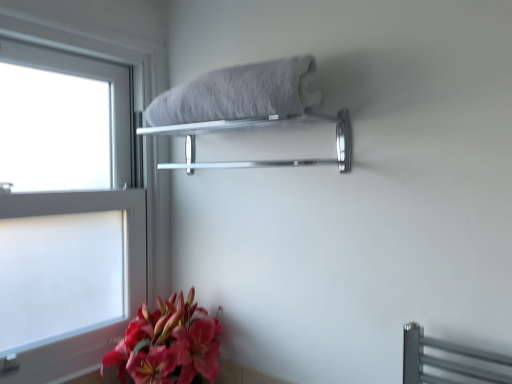
Question: Can you confirm if silver metallic towel rack at upper center is positioned to the right of matte pink lily at lower left?

Choices:
 (A) yes
 (B) no

Answer: (A)

Question: Would you say matte pink lily at lower left is part of silver metallic towel rack at upper center's contents?

Choices:
 (A) yes
 (B) no

Answer: (B)

Question: From a real-world perspective, is silver metallic towel rack at upper center positioned under matte pink lily at lower left based on gravity?

Choices:
 (A) yes
 (B) no

Answer: (B)

Question: Considering the relative sizes of silver metallic towel rack at upper center and matte pink lily at lower left in the image provided, is silver metallic towel rack at upper center thinner than matte pink lily at lower left?

Choices:
 (A) yes
 (B) no

Answer: (A)

Question: Considering the relative positions of silver metallic towel rack at upper center and matte pink lily at lower left in the image provided, is silver metallic towel rack at upper center in front of matte pink lily at lower left?

Choices:
 (A) no
 (B) yes

Answer: (B)

Question: Would you say gray fluffy bath towel at upper center is inside or outside matte pink lily at lower left?

Choices:
 (A) inside
 (B) outside

Answer: (B)

Question: From the image's perspective, is gray fluffy bath towel at upper center above or below matte pink lily at lower left?

Choices:
 (A) above
 (B) below

Answer: (A)

Question: Considering the positions of gray fluffy bath towel at upper center and matte pink lily at lower left in the image, is gray fluffy bath towel at upper center wider or thinner than matte pink lily at lower left?

Choices:
 (A) thin
 (B) wide

Answer: (A)

Question: In the image, is gray fluffy bath towel at upper center positioned in front of or behind matte pink lily at lower left?

Choices:
 (A) front
 (B) behind

Answer: (A)

Question: Looking at the image, does clear glass window at left seem bigger or smaller compared to silver metallic towel rack at upper center?

Choices:
 (A) big
 (B) small

Answer: (A)

Question: Relative to silver metallic towel rack at upper center, is clear glass window at left in front or behind?

Choices:
 (A) front
 (B) behind

Answer: (B)

Question: From a real-world perspective, is clear glass window at left physically located above or below silver metallic towel rack at upper center?

Choices:
 (A) above
 (B) below

Answer: (B)

Question: In the image, is clear glass window at left on the left side or the right side of silver metallic towel rack at upper center?

Choices:
 (A) left
 (B) right

Answer: (A)

Question: Choose the correct answer: Is gray fluffy bath towel at upper center inside silver metallic towel rack at upper center or outside it?

Choices:
 (A) outside
 (B) inside

Answer: (A)

Question: In the image, is gray fluffy bath towel at upper center positioned in front of or behind silver metallic towel rack at upper center?

Choices:
 (A) front
 (B) behind

Answer: (A)